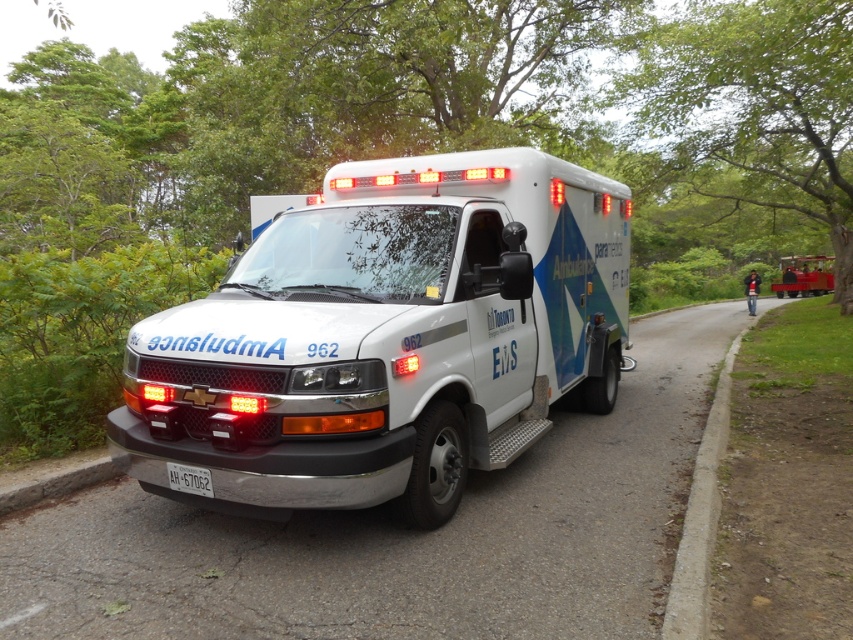
Between white glossy ambulance at center and red rubber trolley at right, which one is positioned higher?

red rubber trolley at right is above.

Does white glossy ambulance at center have a smaller size compared to red rubber trolley at right?

No.

What do you see at coordinates (387, 337) in the screenshot? This screenshot has width=853, height=640. I see `white glossy ambulance at center` at bounding box center [387, 337].

At what (x,y) coordinates should I click in order to perform the action: click on white glossy ambulance at center. Please return your answer as a coordinate pair (x, y). Looking at the image, I should click on (387, 337).

Consider the image. Does white glossy ambulance at center have a greater width compared to white plastic license plate at lower center?

Yes.

Does white glossy ambulance at center appear under white plastic license plate at lower center?

No.

Between point (370, 493) and point (184, 490), which one is positioned in front?

Point (370, 493) is in front.

Where is `white glossy ambulance at center`? white glossy ambulance at center is located at coordinates (387, 337).

Which is behind, point (798, 266) or point (206, 484)?

The point (798, 266) is more distant.

Can you confirm if red rubber trolley at right is positioned to the right of white plastic license plate at lower center?

Yes, red rubber trolley at right is to the right of white plastic license plate at lower center.

Measure the distance between point (793, 272) and camera.

45.31 meters

Image resolution: width=853 pixels, height=640 pixels. I want to click on red rubber trolley at right, so click(804, 275).